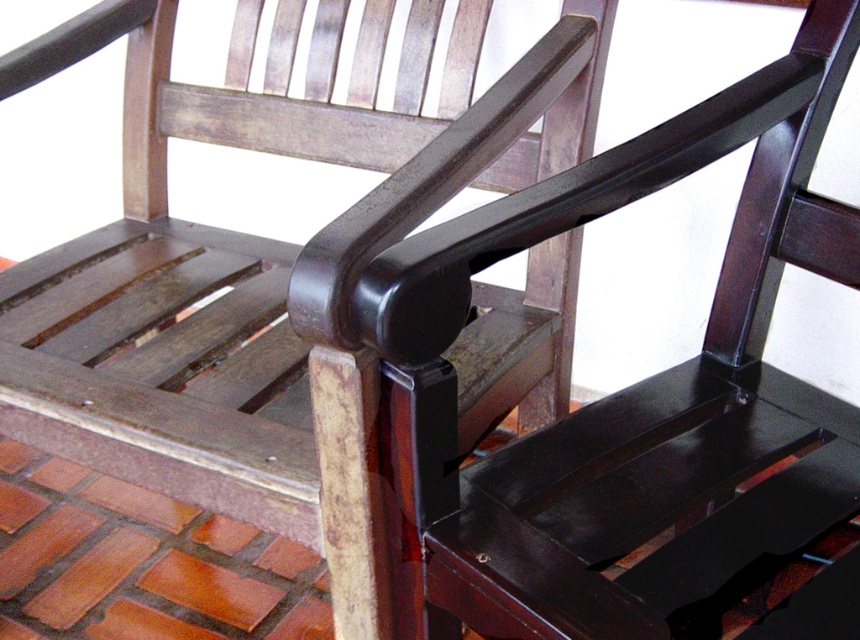
Can you confirm if glossy dark wood armrest at center is positioned above glossy black armrest at center?

No, glossy dark wood armrest at center is not above glossy black armrest at center.

Who is more distant from viewer, (747, 257) or (149, 305)?

Positioned behind is point (149, 305).

Between point (794, 138) and point (124, 412), which one is positioned behind?

Point (124, 412)

The width and height of the screenshot is (860, 640). I want to click on glossy dark wood armrest at center, so click(617, 392).